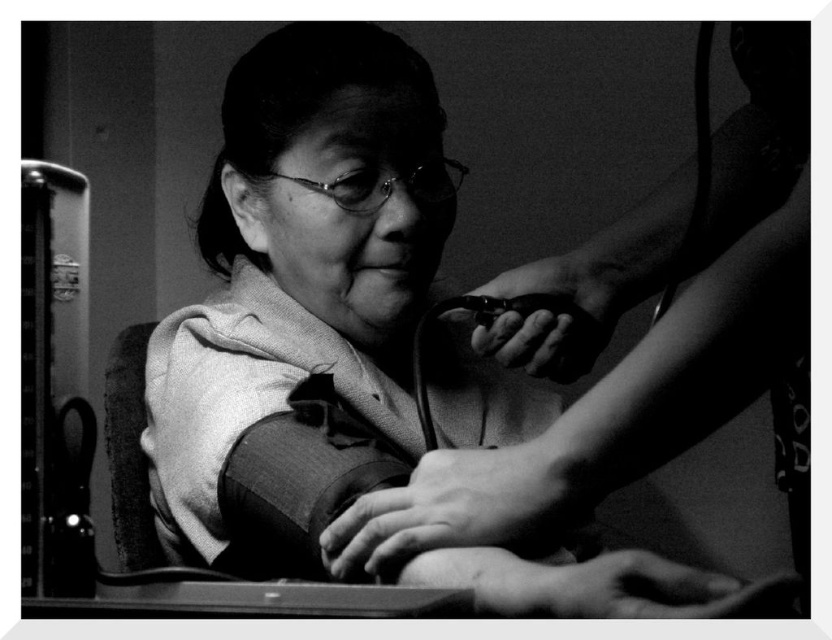
You are a nurse in a clinic and need to locate the smooth plastic comb at upper center for a patient examination. Based on the coordinates provided, where should you look in the image?

The smooth plastic comb at upper center is located at point (x=652, y=339) in the image.

You are a medical student observing a blood pressure measurement procedure. You notice a smooth plastic comb at upper center and black matte hair at upper center. Which object is positioned closer to your viewpoint?

The smooth plastic comb at upper center is closer to the viewer than the black matte hair at upper center.